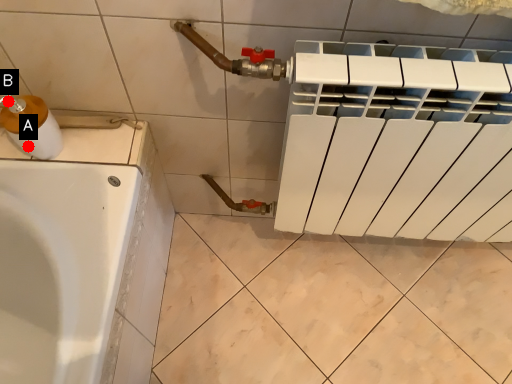
Question: Two points are circled on the image, labeled by A and B beside each circle. Which point appears closest to the camera in this image?

Choices:
 (A) A is closer
 (B) B is closer

Answer: (B)